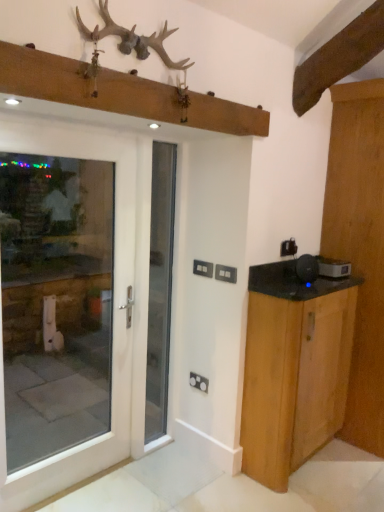
Where is `vacant area situated to the left side of black plastic speaker at right, the 2th appliance in the right-to-left sequence`? vacant area situated to the left side of black plastic speaker at right, the 2th appliance in the right-to-left sequence is located at coordinates [x=278, y=287].